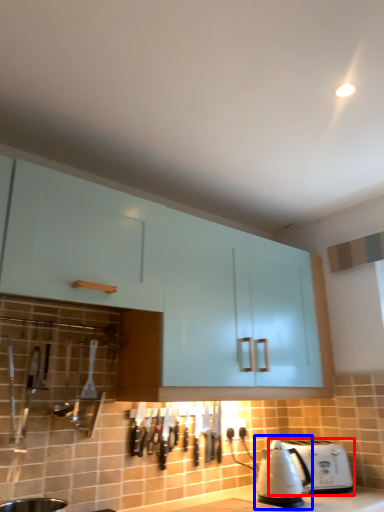
Question: Which of the following is the farthest to the observer, toaster (highlighted by a red box) or kettle (highlighted by a blue box)?

Choices:
 (A) toaster
 (B) kettle

Answer: (A)